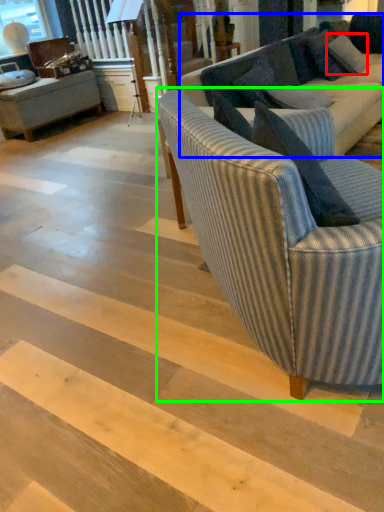
Question: Which object is the farthest from pillow (highlighted by a red box)? Choose among these: studio couch (highlighted by a blue box) or studio couch (highlighted by a green box).

Choices:
 (A) studio couch
 (B) studio couch

Answer: (B)